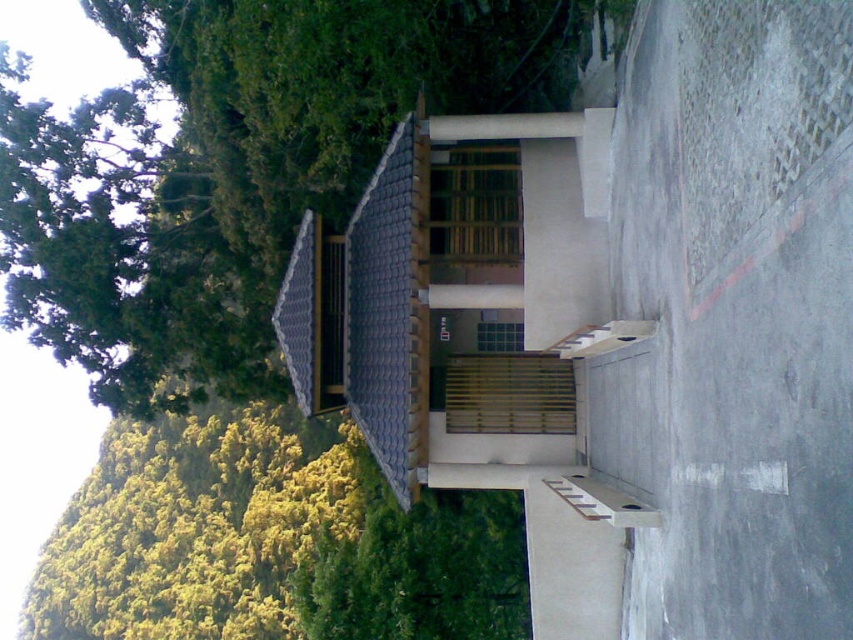
Question: Is green leafy tree at upper left further to camera compared to wooden stairs at lower center?

Choices:
 (A) yes
 (B) no

Answer: (A)

Question: Is green leafy tree at upper left positioned before wooden stairs at lower center?

Choices:
 (A) yes
 (B) no

Answer: (B)

Question: Which of the following is the farthest from the observer?

Choices:
 (A) wooden stairs at lower center
 (B) green leafy tree at upper left

Answer: (B)

Question: Does green leafy tree at upper left appear on the right side of wooden stairs at lower center?

Choices:
 (A) no
 (B) yes

Answer: (A)